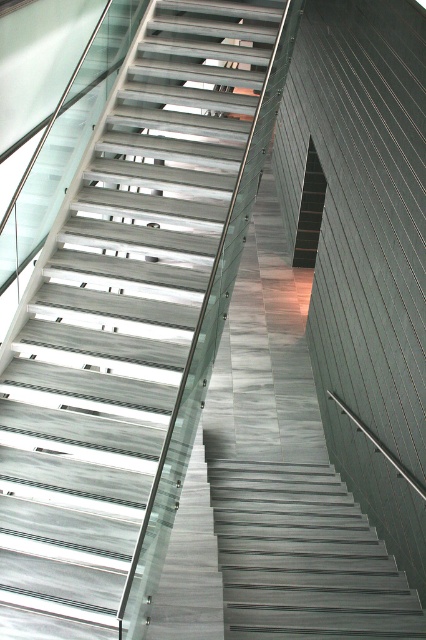
You are standing at the bottom of the staircase and want to go up. Which object should you step on first, the metallic gray stairs at center or the black matte stair at center?

You should step on the black matte stair at center first because the metallic gray stairs at center is above it, meaning the black matte stair at center is the first step.

You are a delivery person carrying a heavy box and need to ascend the stairs. You notice two stair options in the image, the metallic gray stairs at center and the black matte stair at center. Which stair option is physically smaller in size and thus might be harder to step on?

The metallic gray stairs at center has a smaller size compared to the black matte stair at center, so it might be harder to step on due to its smaller size.

You are standing at the bottom of the staircase and want to reach the door located on the right side of the upper floor. Which stair should you step onto first, the metallic gray stairs at center or the black matte stair at center?

You should step onto the metallic gray stairs at center first because they are positioned to the left of the black matte stair at center, which would help you move towards the right side of the upper floor.